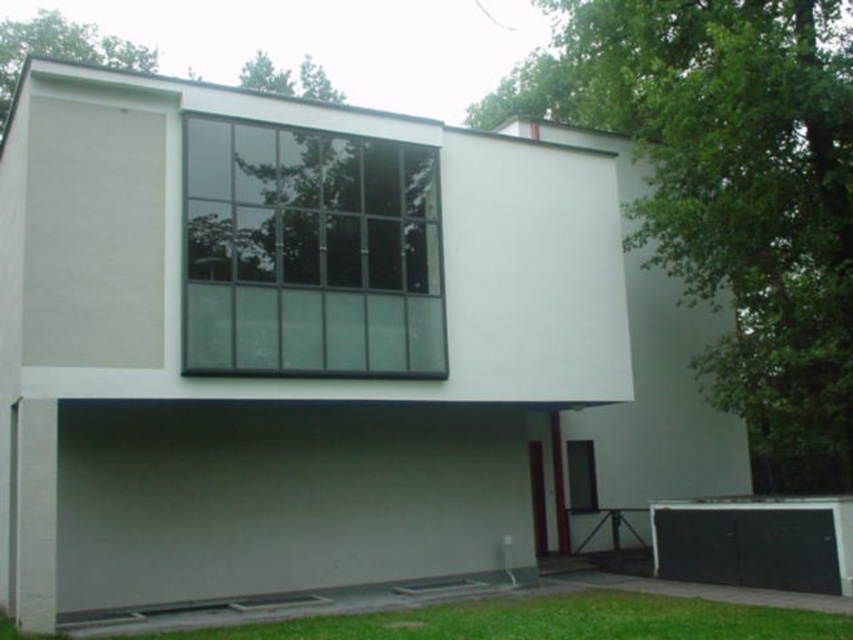
You are an architect designing a new building. You need to install a new ventilation system. The system requires a space wider than the black matte garage door at lower right. Can the transparent glass window at center provide sufficient width for this requirement?

The transparent glass window at center is wider than the black matte garage door at lower right, so yes, the transparent glass window at center can provide sufficient width for the ventilation system requiring a space wider than the black matte garage door at lower right.

You are a delivery person approaching the building and need to locate the entrance. The transparent glass window at center and the black matte garage door at lower right are visible from your vantage point. Which object is situated higher up on the building?

The transparent glass window at center is positioned over the black matte garage door at lower right, so it is situated higher up on the building.

You are a window installer assessing the building. You need to replace the transparent glass window at center and the black matte garage door at lower right. Which object requires a taller replacement panel?

The transparent glass window at center requires a taller replacement panel since it is much taller than the black matte garage door at lower right.